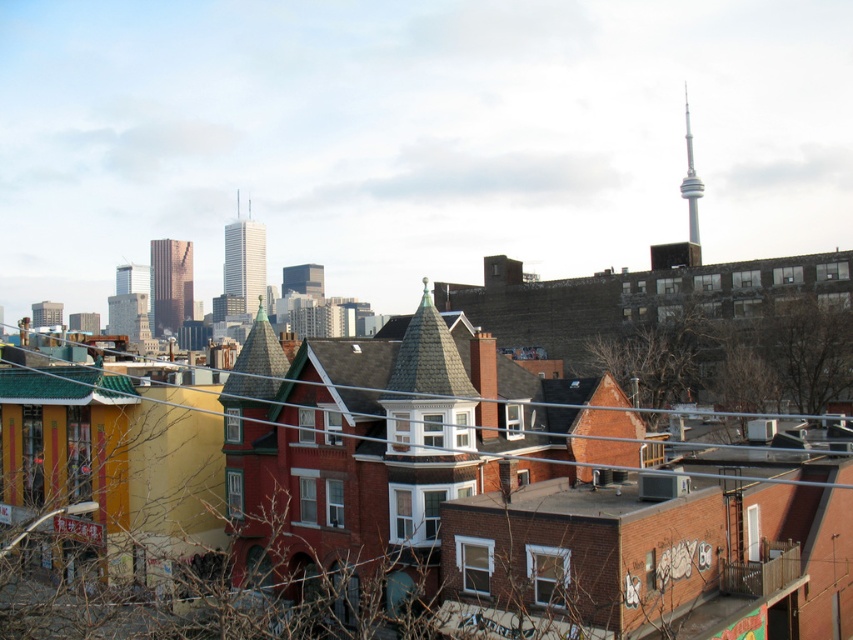
Does point (160, 332) come behind point (241, 227)?

Yes, point (160, 332) is farther from viewer.

Is point (190, 308) closer to viewer compared to point (225, 227)?

Yes, it is.

Locate an element on the screen. The width and height of the screenshot is (853, 640). shiny glass skyscraper at center is located at coordinates (170, 284).

Can you confirm if metallic wire at lower center is positioned to the right of smooth glass skyscraper at center?

Yes, metallic wire at lower center is to the right of smooth glass skyscraper at center.

This screenshot has height=640, width=853. Identify the location of metallic wire at lower center. (317, 420).

Between metallic wire at lower center and shiny glass skyscraper at center, which one has more height?

shiny glass skyscraper at center is taller.

Can you confirm if metallic wire at lower center is smaller than shiny glass skyscraper at center?

Yes, metallic wire at lower center is smaller than shiny glass skyscraper at center.

You are a GUI agent. You are given a task and a screenshot of the screen. Output one action in this format:
    pyautogui.click(x=<x>, y=<y>)
    Task: Click on the metallic wire at lower center
    This screenshot has height=640, width=853.
    Given the screenshot: What is the action you would take?
    pyautogui.click(x=317, y=420)

Where is `metallic wire at lower center`? The image size is (853, 640). metallic wire at lower center is located at coordinates (317, 420).